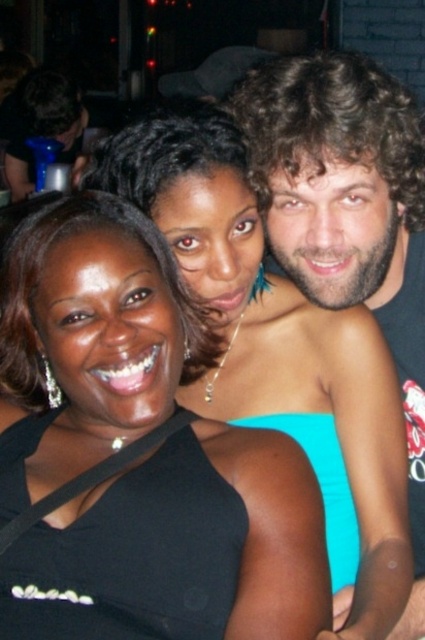
You are a photographer trying to adjust the lighting for a group photo. The scene includes a matte black dress at center and curly hair at upper right. Which object should you focus on first to ensure proper exposure, considering their positions?

The matte black dress at center should be focused on first because it is in front of the curly hair at upper right, making it the primary subject in the frame.

From the picture: Based on the scene description, which object is shorter in height between the matte black dress at center and the curly hair at upper right?

The matte black dress at center is shorter in height compared to the curly hair at upper right.